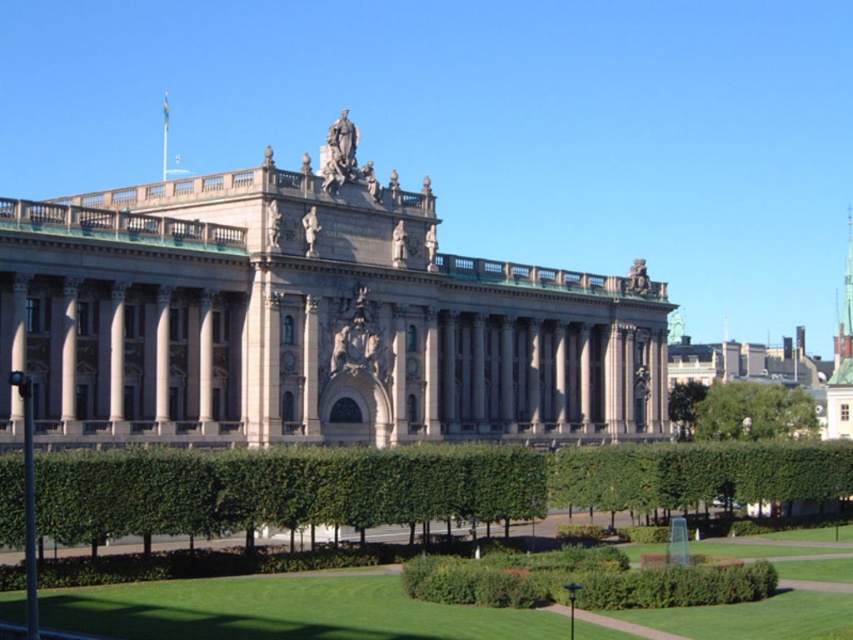
You are standing in front of the beige stone palace at center. If you were to walk directly towards the palace, which direction would you face?

Since the beige stone palace at center is located at point [308,320] in the 2D coordinate system, you would face directly towards the center of the image to walk towards it.

Based on the photo, you are standing in the garden of the beige stone palace at center and want to take a photo of the green leafy tree at lower right. Since the palace is between you and the tree, will the palace block your view of the tree?

The beige stone palace at center is in front of the green leafy tree at lower right, so the palace will block your view of the tree when taking the photo.

You are standing in the garden looking towards the beige stone palace at center. There is a green leafy tree at lower right. Which object is wider from your perspective?

The beige stone palace at center is wider than the green leafy tree at lower right according to the description.